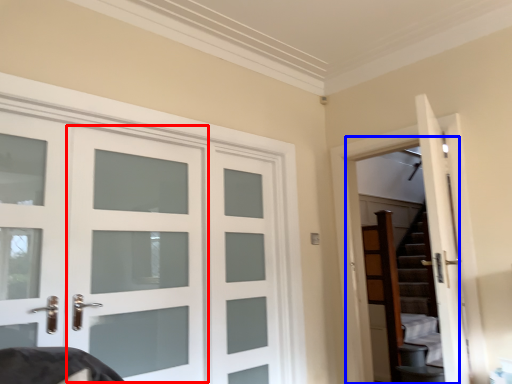
Question: Among these objects, which one is farthest to the camera, screen door (highlighted by a red box) or garage door (highlighted by a blue box)?

Choices:
 (A) screen door
 (B) garage door

Answer: (B)